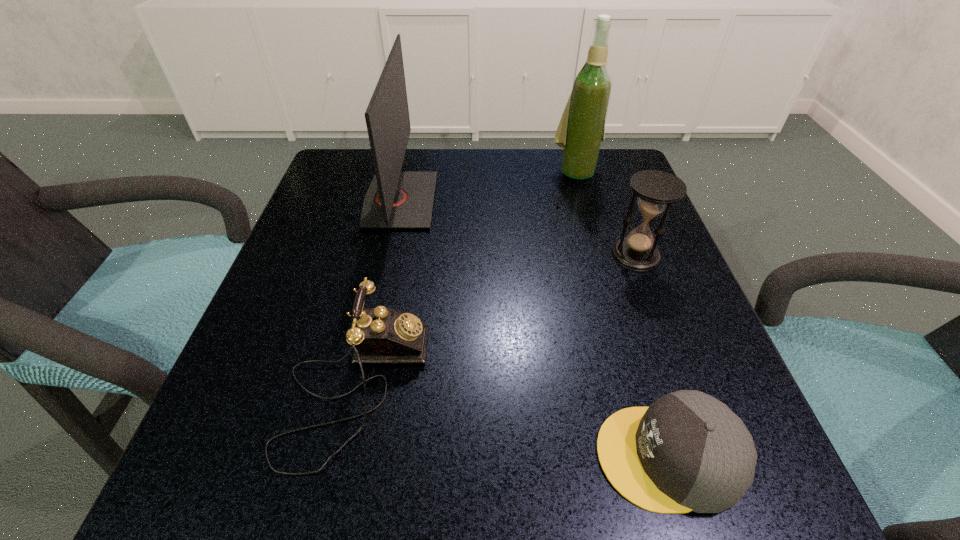
The width and height of the screenshot is (960, 540). Find the location of `free space between the wine bottle and the hourglass`. free space between the wine bottle and the hourglass is located at coordinates 606,213.

Identify the location of unoccupied position between the cap and the wine bottle. (622, 314).

Locate which object is the fourth closest to the monitor. Please provide its 2D coordinates. Your answer should be formatted as a tuple, i.e. [(x, y)], where the tuple contains the x and y coordinates of a point satisfying the conditions above.

[(687, 451)]

Find the location of a particular element. object that is the third nearest to the monitor is located at coordinates (656, 190).

Image resolution: width=960 pixels, height=540 pixels. In order to click on vacant position in the image that satisfies the following two spatial constraints: 1. on the front-facing side of the wine bottle; 2. on the screen side of the fourth shortest object in this screenshot , I will do `click(584, 200)`.

Identify the location of free location that satisfies the following two spatial constraints: 1. on the front-facing side of the wine bottle; 2. on the left side of the hourglass. The image size is (960, 540). (599, 255).

Identify the location of free spot that satisfies the following two spatial constraints: 1. on the front-facing side of the wine bottle; 2. on the left side of the hourglass. (599, 255).

Find the location of a particular element. The width and height of the screenshot is (960, 540). free spot that satisfies the following two spatial constraints: 1. on the front-facing side of the wine bottle; 2. on the screen side of the fourth shortest object is located at coordinates (584, 200).